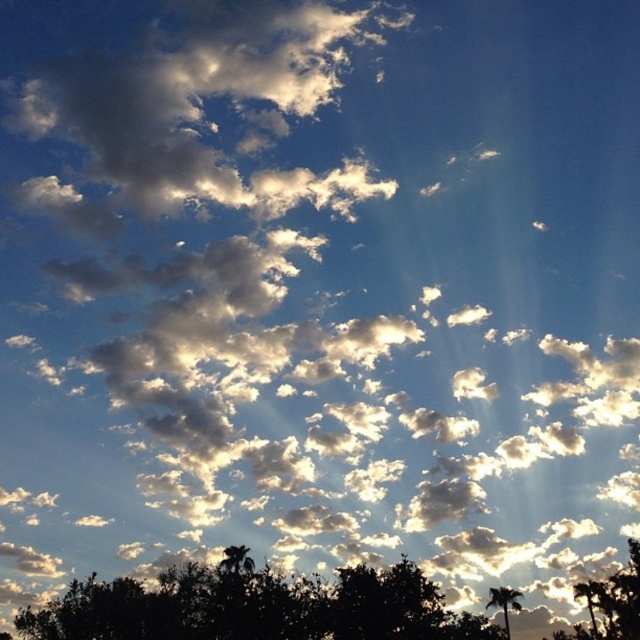
Can you confirm if silhouette leafy tree at lower center is shorter than green leafy tree at lower right?

Incorrect, silhouette leafy tree at lower center's height does not fall short of green leafy tree at lower right's.

Can you confirm if silhouette leafy tree at lower center is wider than green leafy tree at lower right?

Yes, silhouette leafy tree at lower center is wider than green leafy tree at lower right.

Is point (214, 586) positioned after point (504, 611)?

No, it is in front of (504, 611).

Where is `silhouette leafy tree at lower center`? silhouette leafy tree at lower center is located at coordinates (x=257, y=608).